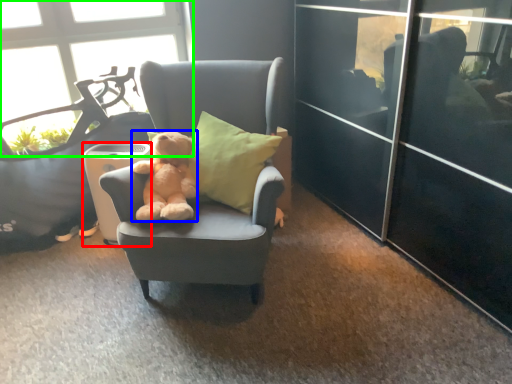
Question: Estimate the real-world distances between objects in this image. Which object is farther from trash bin/can (highlighted by a red box), teddy bear (highlighted by a blue box) or window (highlighted by a green box)?

Choices:
 (A) teddy bear
 (B) window

Answer: (B)